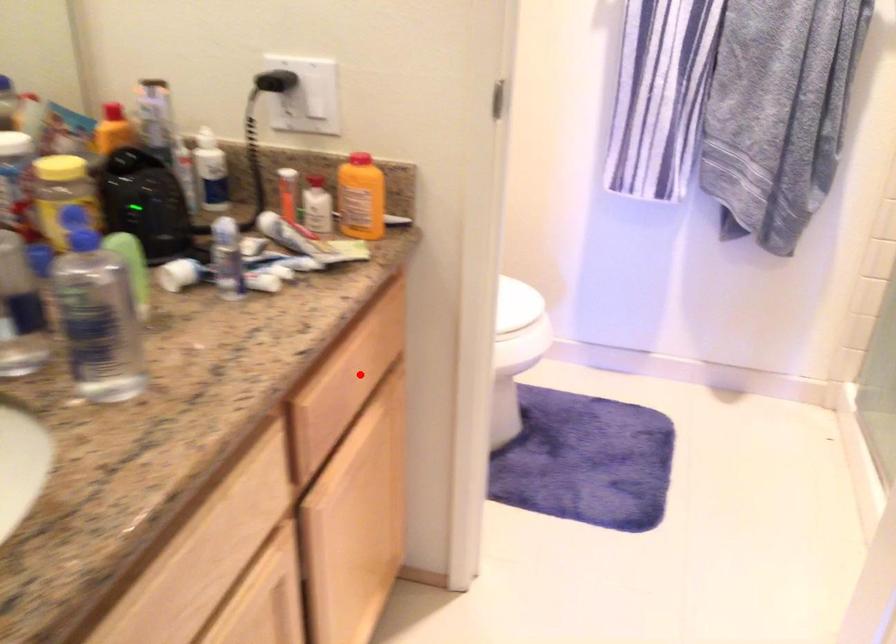
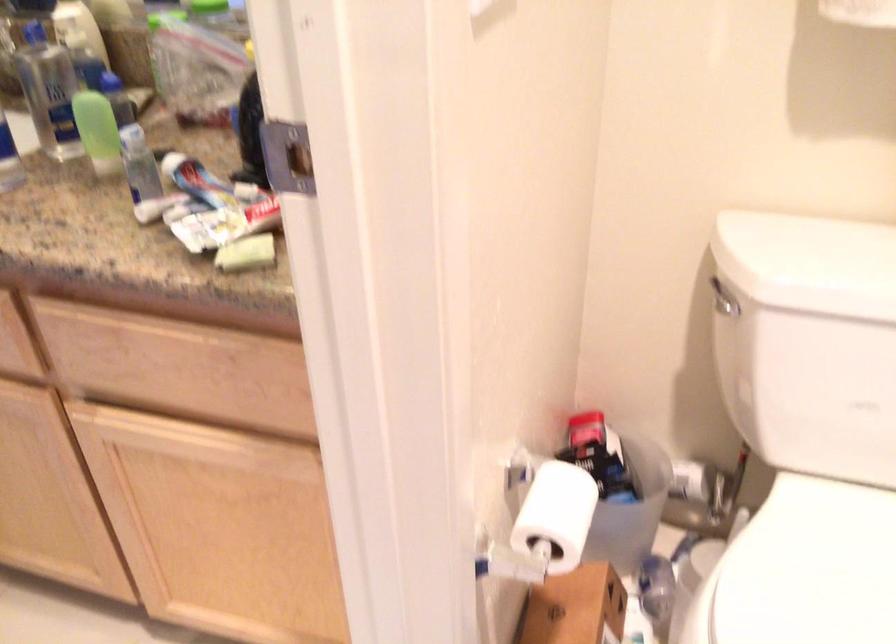
The point at the highlighted location is marked in the first image. Where is the corresponding point in the second image?

(177, 368)